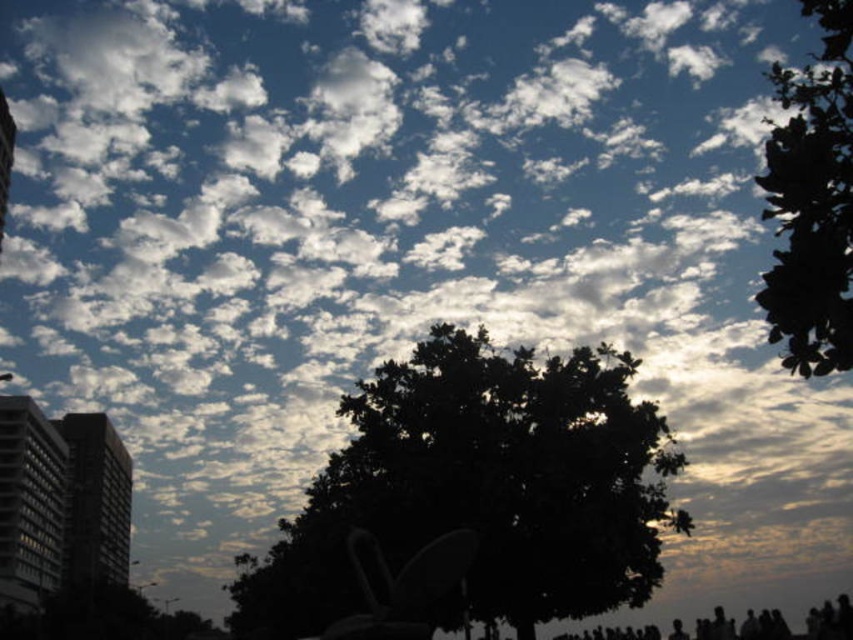
You are an architect analyzing the composition of this sky scene. You need to determine the exact position of the gray concrete building at left in the image. What are its coordinates?

The gray concrete building at left is located at coordinates point (30, 502).

You are standing in front of the sky scene and want to determine which of the two points, point (509, 468) or point (82, 560), is nearer to your viewpoint. Based on the image, which point is closer?

Point (509, 468) is closer to the camera than point (82, 560), so it is the nearer one.